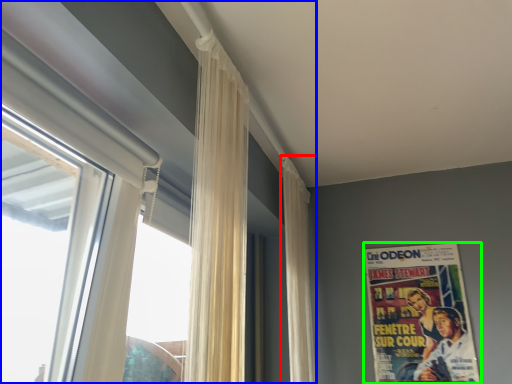
Question: Considering the real-world distances, which object is closest to curtain (highlighted by a red box)? window (highlighted by a blue box) or poster (highlighted by a green box).

Choices:
 (A) window
 (B) poster

Answer: (B)